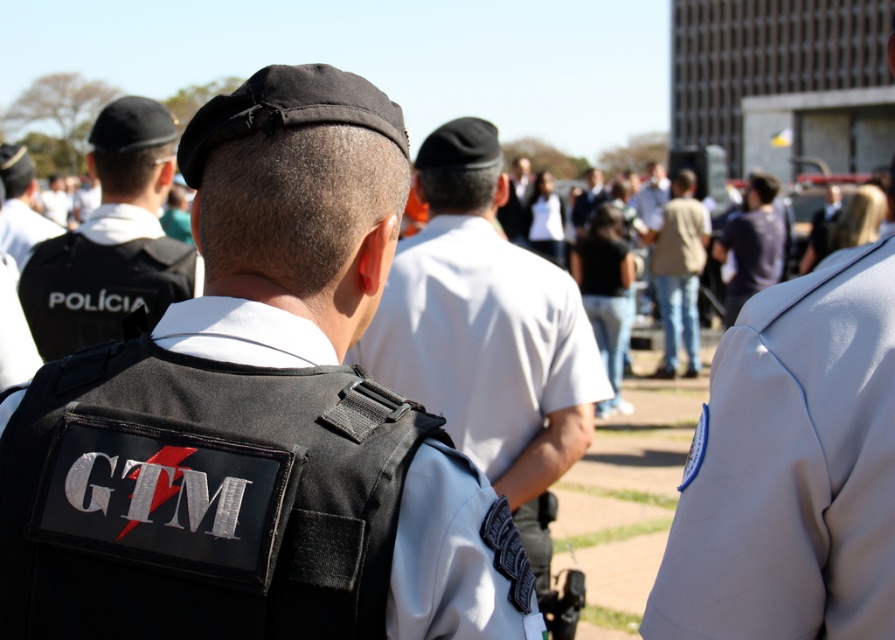
Question: Which object is the farthest from the white uniform shirt at center?

Choices:
 (A) black matte vest at left
 (B) white uniform at center

Answer: (B)

Question: Is white uniform shirt at center positioned before dark blue shirt at center?

Choices:
 (A) no
 (B) yes

Answer: (B)

Question: Does black tactical vest at center appear on the right side of white uniform at center?

Choices:
 (A) yes
 (B) no

Answer: (A)

Question: Which point appears farthest from the camera in this image?

Choices:
 (A) (662, 221)
 (B) (452, 627)

Answer: (A)

Question: Which object appears farthest from the camera in this image?

Choices:
 (A) black matte vest at left
 (B) white uniform at center
 (C) black tactical vest at center

Answer: (B)

Question: Is black tactical vest at center above dark blue shirt at center?

Choices:
 (A) no
 (B) yes

Answer: (A)